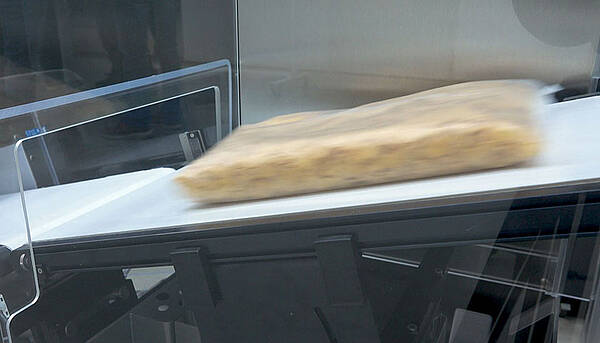
In order to click on white wall tiles in this screenshot , I will do `click(275, 37)`, `click(371, 42)`, `click(500, 52)`, `click(349, 89)`, `click(273, 86)`.